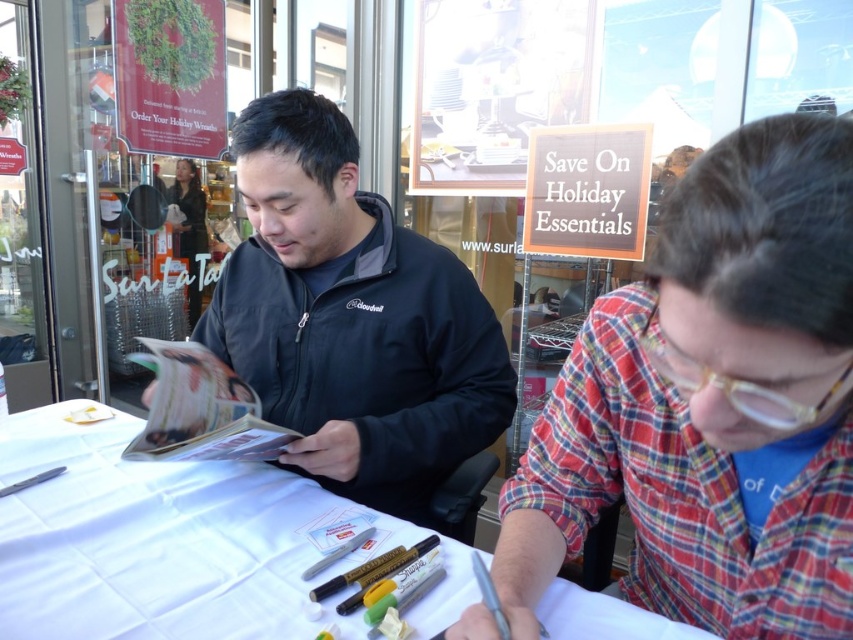
You are a customer in the store and want to place your coffee cup on the table. The table has a white cloth and has items like markers, pens, and small packets. Where should you place your coffee cup so it doesn not spill onto the black matte jacket at center?

The black matte jacket at center is located at point (351, 317), so you should place your coffee cup away from that position to avoid spilling on it.

You are a customer in the store and want to hand a document to both the person in the plaid shirt at right and the person in the black matte jacket at center. Which person should you approach first if you are standing in front of the table?

You should approach the plaid shirt at right first because it is positioned on the right side of the black matte jacket at center, making it closer to your position when standing in front of the table.

You are trying to determine if the plaid shirt at right can be placed on the white paper at center without folding it. Based on their sizes, is this possible?

The plaid shirt at right is taller than the white paper at center, so it cannot be placed on the paper without folding since it exceeds the paper in height.